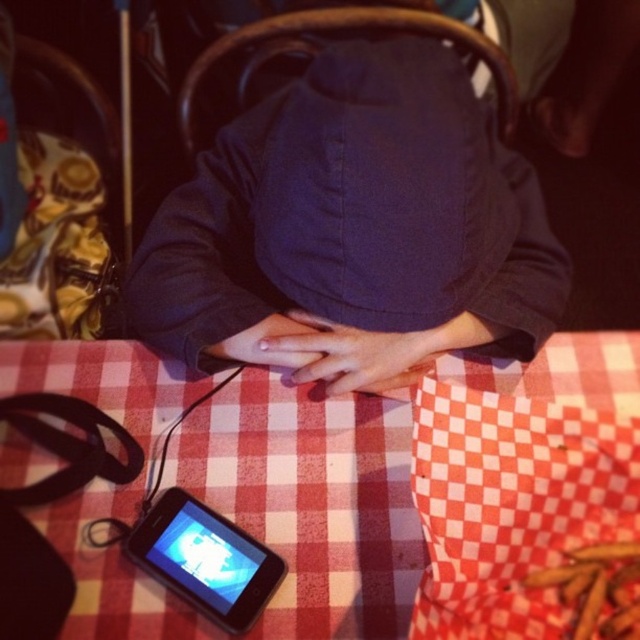
You are a delivery person who needs to place a small package on the table. The package must be placed between the dark blue fabric at center and the black glossy ipod at lower left. Can you do this without moving either object?

The dark blue fabric at center is closer to the viewer than the black glossy ipod at lower left, so there is space between them for placing the package without moving either object.

You are a delivery person who needs to place a small package on the table. The table has a dark blue fabric at center and a black glossy ipod at lower left. Where should you place the package so it doesn not block the ipod?

The dark blue fabric at center is positioned on the right side of the black glossy ipod at lower left, so placing the package to the left of the black glossy ipod at lower left would avoid blocking it.